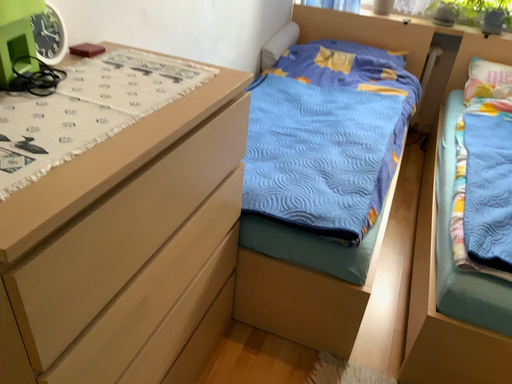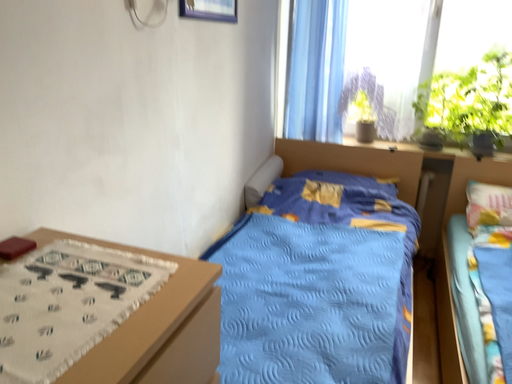
Question: Which way did the camera rotate in the video?

Choices:
 (A) rotated upward
 (B) rotated downward

Answer: (A)